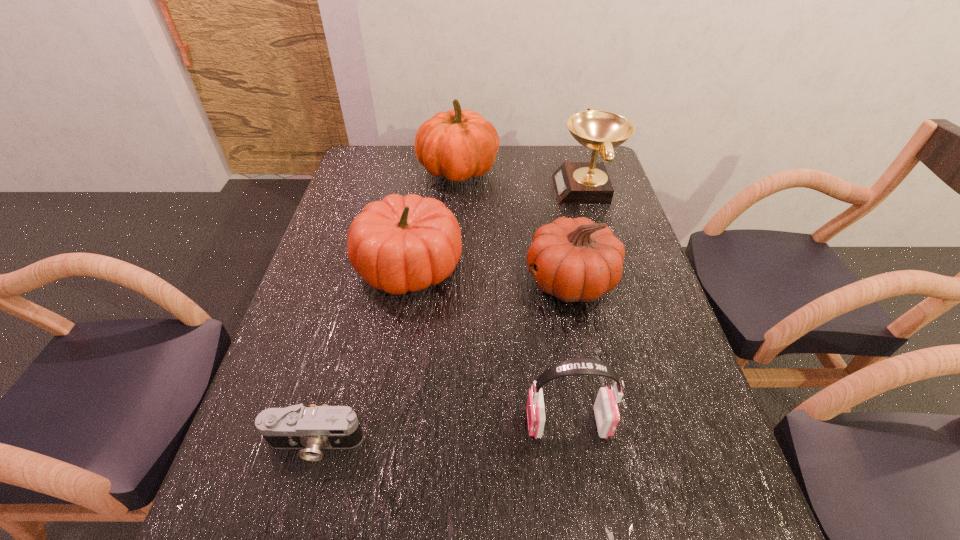
At what (x,y) coordinates should I click in order to perform the action: click on award at the right edge. Please return your answer as a coordinate pair (x, y). The width and height of the screenshot is (960, 540). Looking at the image, I should click on (575, 182).

Identify the location of pumpkin positioned at the right edge. (579, 260).

You are a GUI agent. You are given a task and a screenshot of the screen. Output one action in this format:
    pyautogui.click(x=<x>, y=<y>)
    Task: Click on the object that is positioned at the far right corner
    Image resolution: width=960 pixels, height=540 pixels.
    Given the screenshot: What is the action you would take?
    pyautogui.click(x=575, y=182)

This screenshot has height=540, width=960. In order to click on vacant space at the far edge in this screenshot , I will do `click(411, 148)`.

The width and height of the screenshot is (960, 540). In order to click on vacant space at the left edge of the desktop in this screenshot , I will do `click(387, 187)`.

In the image, there is a desktop. Where is `vacant space at the right edge`? The height and width of the screenshot is (540, 960). vacant space at the right edge is located at coordinates (628, 413).

This screenshot has width=960, height=540. In order to click on free space at the far left corner in this screenshot , I will do `click(363, 161)`.

Where is `vacant area that lies between the tallest pumpkin and the earphone`? The image size is (960, 540). vacant area that lies between the tallest pumpkin and the earphone is located at coordinates (513, 298).

Locate an element on the screen. empty space between the shortest object and the earphone is located at coordinates coord(442,433).

I want to click on free space between the shortest object and the rightmost pumpkin, so click(x=443, y=362).